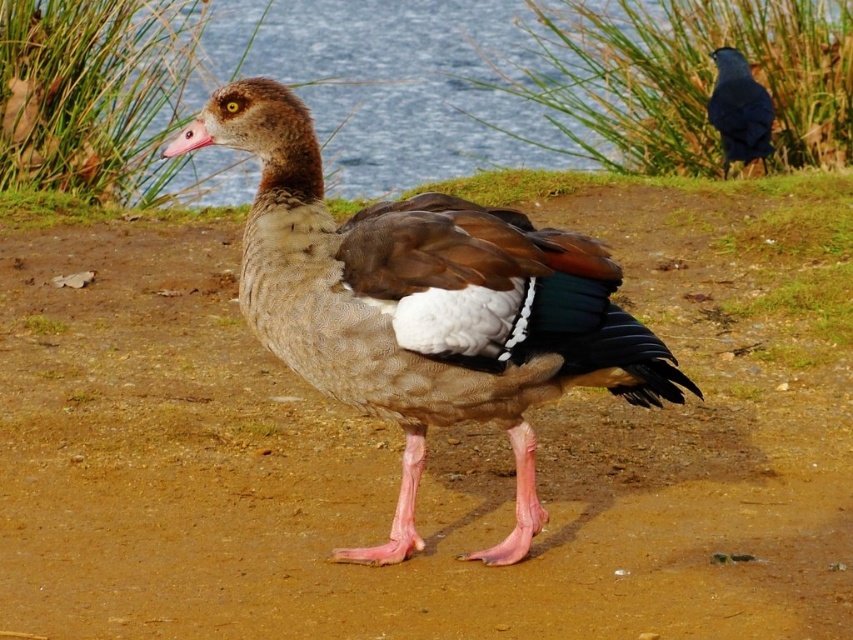
You are a photographer trying to capture a shot of the shiny blue bird at upper right and the blue water at upper center. If you want to ensure both are in focus, what should you consider about their distance?

The blue water at upper center is 6.47 feet away from the shiny blue bird at upper right. To have both in focus, the photographer should use a small aperture setting to increase depth of field, ensuring both subjects are within the focal range.

You are a photographer aiming to capture the shiny blue bird at upper right without the blue water at upper center blocking the view. Can you adjust your position to achieve this?

The shiny blue bird at upper right is behind the blue water at upper center, so moving your position might not help as the bird is obscured by the water from your current viewpoint.

You are a photographer trying to capture the brown feathered duck at center. You notice the brown dirt field at center is blocking your view. Can you adjust your position to see the duck without moving it?

The brown dirt field at center is above the brown feathered duck at center, so you can lower your camera angle to see the duck below the dirt field.